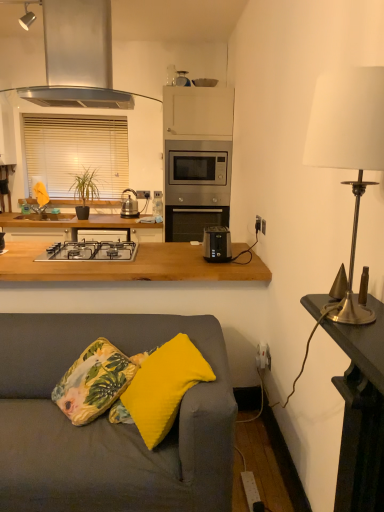
Locate an element on the screen. The width and height of the screenshot is (384, 512). empty space that is ontop of white blinds at upper left is located at coordinates (78, 113).